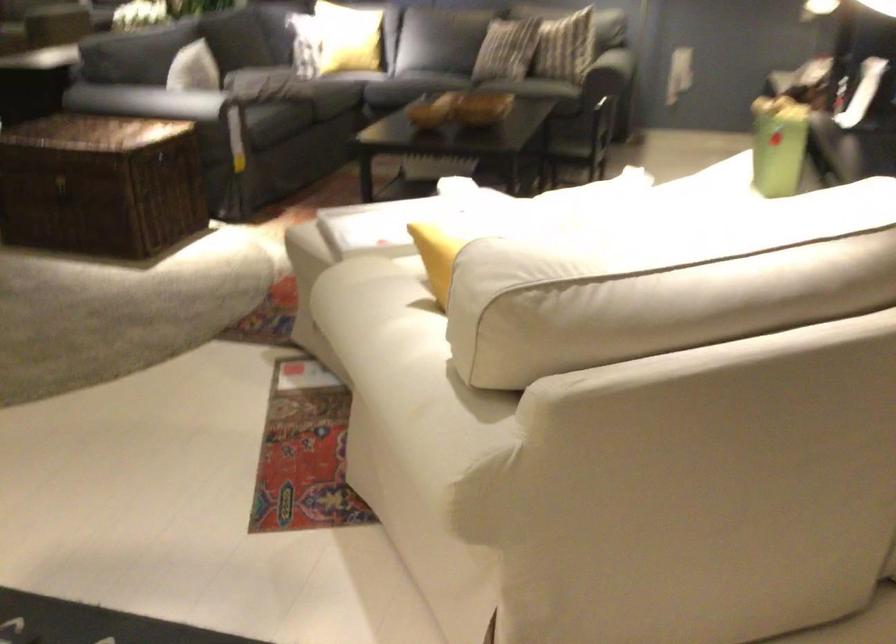
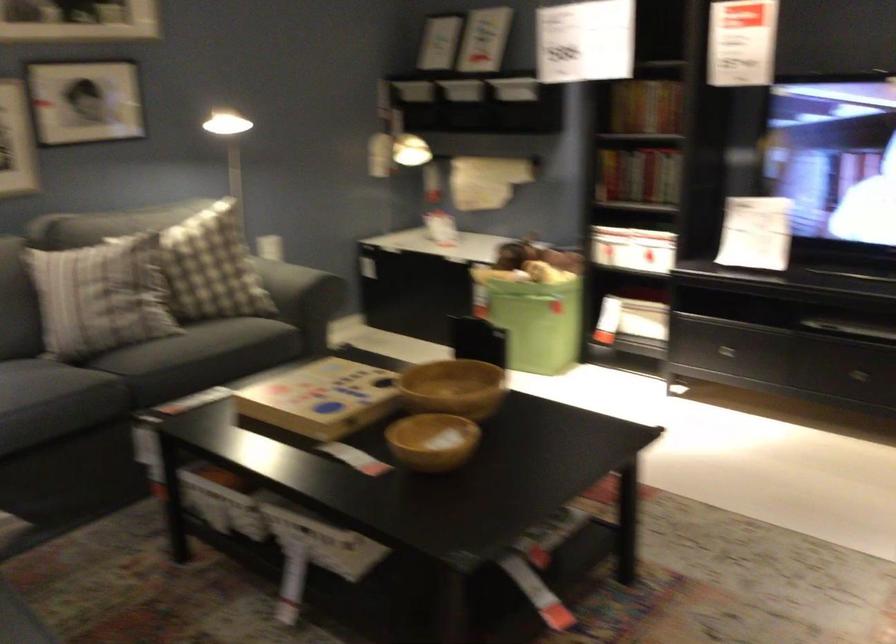
In the second image, find the point that corresponds to point 438,114 in the first image.

(433, 440)